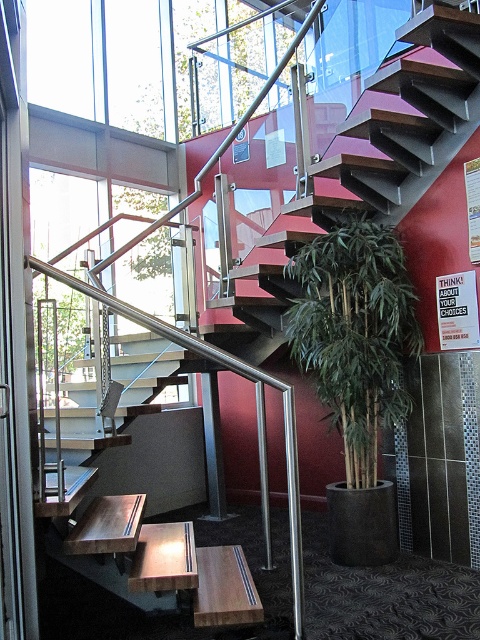
You are a delivery person carrying a package and need to move from the wooden bench at lower center to the green bamboo at center. The package requires a minimum of 5 feet of space to maneuver safely. Can you navigate the space between them?

The distance between the green bamboo at center and wooden bench at lower center is 4.52 feet, which is less than the required 5 feet. Therefore, you cannot safely maneuver the package through the space between them.

You are an interior designer planning to place a new decorative item in the space. The wooden bench at lower center is currently narrower than the green bamboo at center. Which object should you place the item next to if you want it to be more visually balanced with the existing objects?

The green bamboo at center has a greater width than the wooden bench at lower center, so placing the new decorative item next to the wooden bench at lower center would help achieve a more balanced visual arrangement.